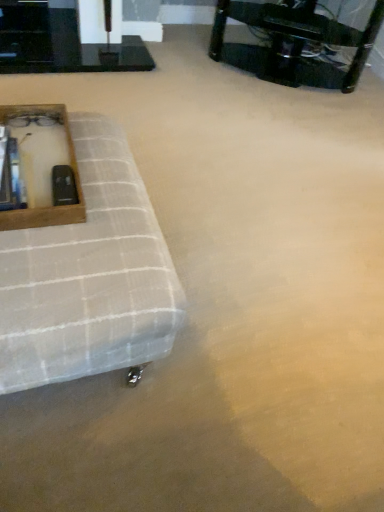
Question: From a real-world perspective, is black plastic table at upper right, positioned as the first table in right-to-left order, beneath black glossy table at upper left, the 2th table viewed from the right?

Choices:
 (A) yes
 (B) no

Answer: (B)

Question: Is black plastic table at upper right, positioned as the first table in right-to-left order, completely or partially outside of black glossy table at upper left, the first table when ordered from left to right?

Choices:
 (A) no
 (B) yes

Answer: (B)

Question: From a real-world perspective, is black plastic table at upper right, acting as the second table starting from the left, on top of black glossy table at upper left, the 2th table viewed from the right?

Choices:
 (A) yes
 (B) no

Answer: (A)

Question: Does black plastic table at upper right, positioned as the first table in right-to-left order, have a greater width compared to black glossy table at upper left, the 2th table viewed from the right?

Choices:
 (A) yes
 (B) no

Answer: (A)

Question: Is black plastic table at upper right, positioned as the first table in right-to-left order, far away from black glossy table at upper left, the first table when ordered from left to right?

Choices:
 (A) no
 (B) yes

Answer: (A)

Question: Can you confirm if black plastic table at upper right, positioned as the first table in right-to-left order, is positioned to the right of black glossy table at upper left, the first table when ordered from left to right?

Choices:
 (A) no
 (B) yes

Answer: (B)

Question: Can you confirm if wooden frame at left is smaller than black glossy table at upper left, the first table when ordered from left to right?

Choices:
 (A) no
 (B) yes

Answer: (B)

Question: From a real-world perspective, does wooden frame at left sit lower than black glossy table at upper left, the first table when ordered from left to right?

Choices:
 (A) yes
 (B) no

Answer: (B)

Question: Does wooden frame at left have a greater width compared to black glossy table at upper left, the first table when ordered from left to right?

Choices:
 (A) yes
 (B) no

Answer: (A)

Question: Would you consider wooden frame at left to be distant from black glossy table at upper left, the 2th table viewed from the right?

Choices:
 (A) yes
 (B) no

Answer: (A)

Question: Is wooden frame at left to the right of black glossy table at upper left, the first table when ordered from left to right, from the viewer's perspective?

Choices:
 (A) no
 (B) yes

Answer: (B)

Question: From the image's perspective, does wooden frame at left appear higher than black glossy table at upper left, the first table when ordered from left to right?

Choices:
 (A) yes
 (B) no

Answer: (B)

Question: Is white textured ottoman at left bigger than black glossy table at upper left, the first table when ordered from left to right?

Choices:
 (A) no
 (B) yes

Answer: (B)